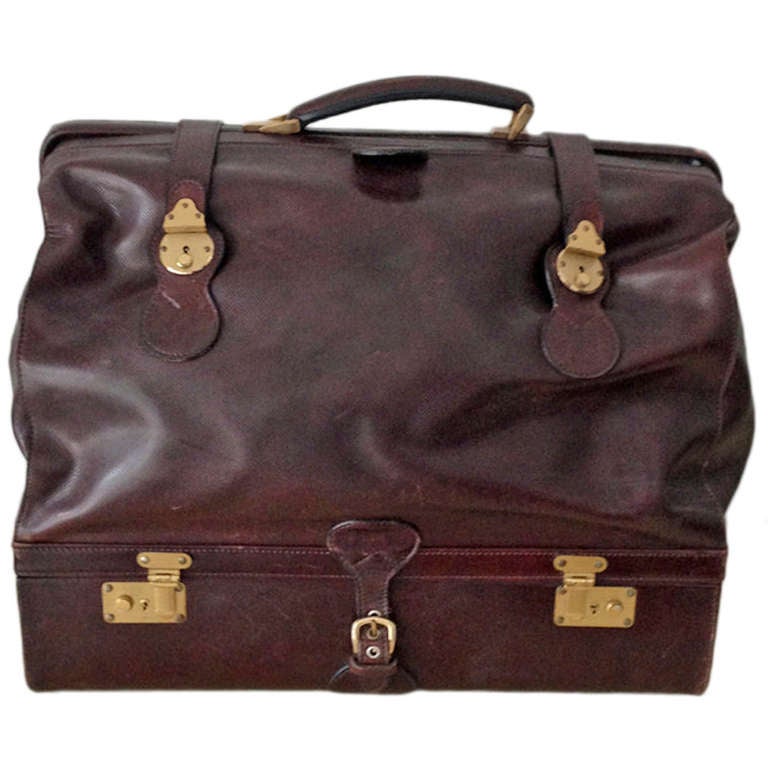
Locate an element on the screen. gold accent pieces at top is located at coordinates (180, 220), (584, 237).